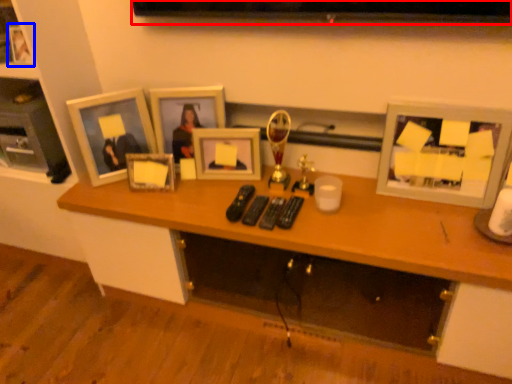
Question: Which object appears closest to the camera in this image, television (highlighted by a red box) or picture frame (highlighted by a blue box)?

Choices:
 (A) television
 (B) picture frame

Answer: (A)